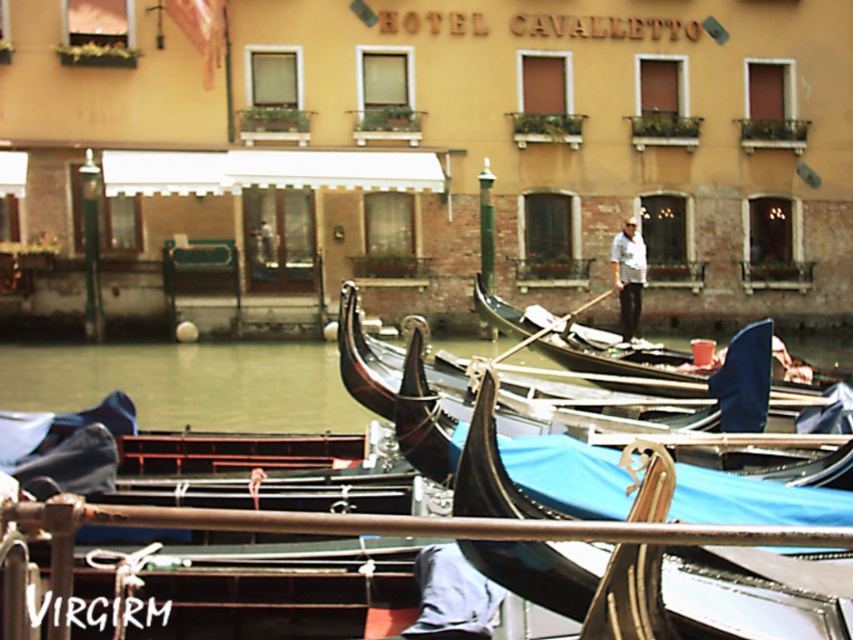
In the scene shown: Is wooden gondola at center further to camera compared to black polished gondola at center?

No, wooden gondola at center is closer to the viewer.

Identify the location of wooden gondola at center. (784, 467).

Identify the location of wooden gondola at center. (784, 467).

This screenshot has height=640, width=853. I want to click on wooden gondola at center, so click(784, 467).

Is black polished gondola at center bigger than white cotton shirt at center?

Yes, black polished gondola at center is bigger than white cotton shirt at center.

Can you confirm if black polished gondola at center is wider than white cotton shirt at center?

Yes, black polished gondola at center is wider than white cotton shirt at center.

Describe the element at coordinates (624, 364) in the screenshot. Image resolution: width=853 pixels, height=640 pixels. I see `black polished gondola at center` at that location.

The width and height of the screenshot is (853, 640). Identify the location of black polished gondola at center. (624, 364).

Is the position of wooden gondola at center more distant than that of white cotton shirt at center?

No.

Is point (846, 460) less distant than point (618, 289)?

Yes.

Is point (463, 394) closer to camera compared to point (636, 284)?

Yes, it is.

The height and width of the screenshot is (640, 853). I want to click on wooden gondola at center, so click(x=784, y=467).